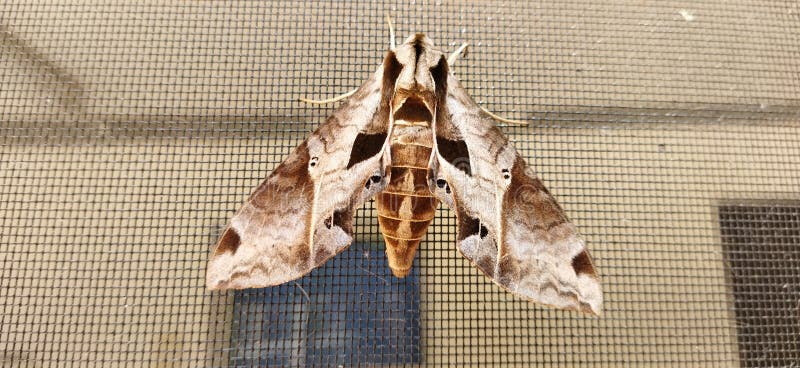
Where is `glass`? This screenshot has width=800, height=368. glass is located at coordinates (346, 305).